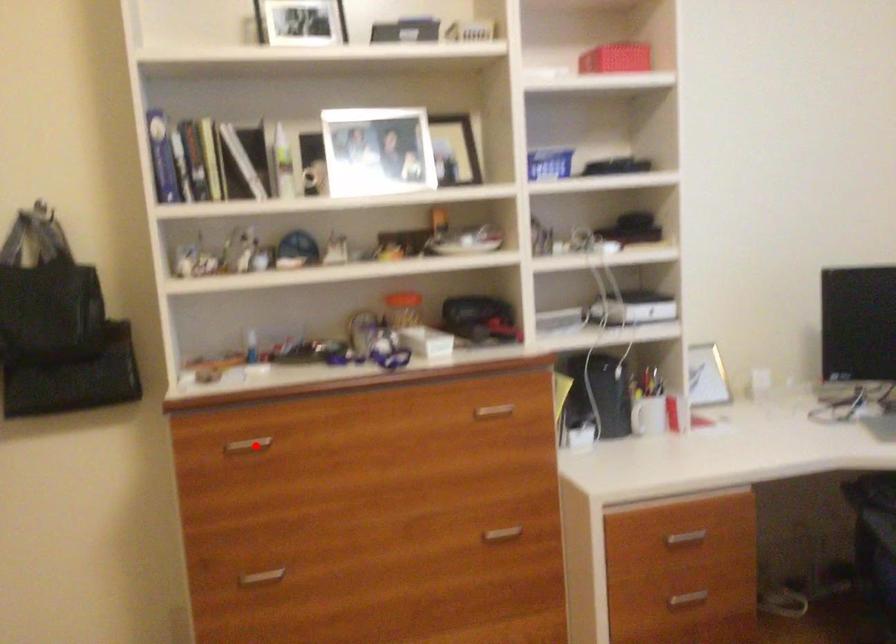
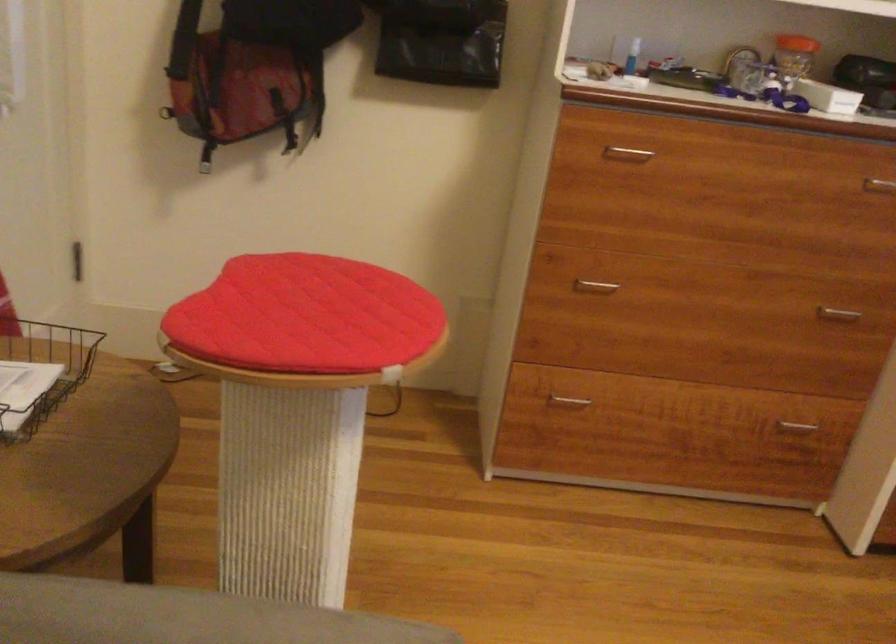
Where in the second image is the point corresponding to the highlighted location from the first image?

(626, 154)